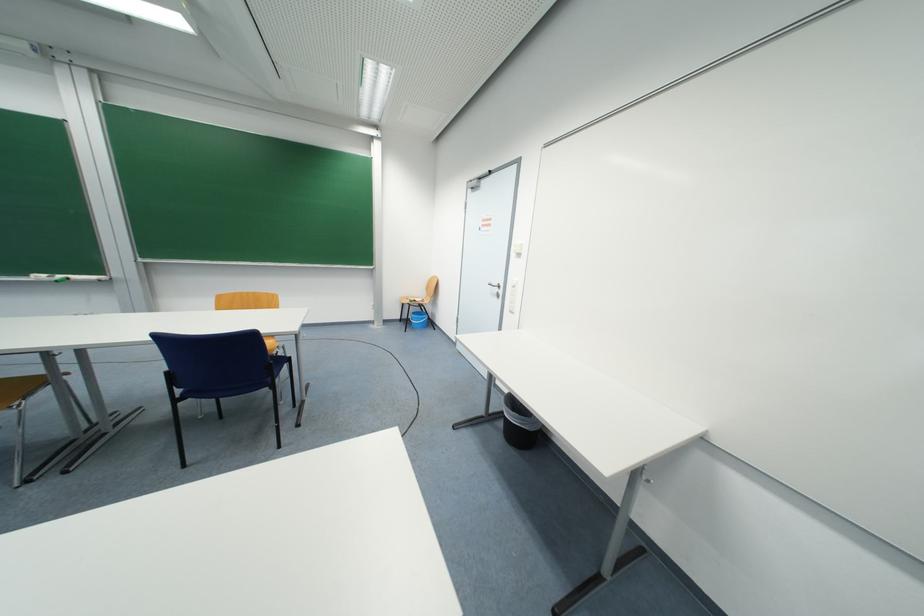
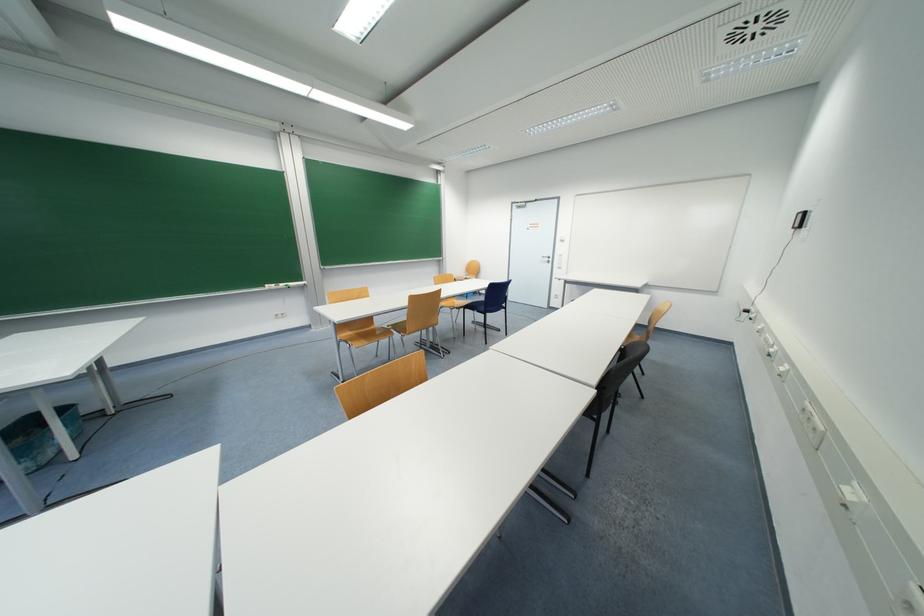
In the second image, find the point that corresponds to the point at 66,278 in the first image.

(286, 286)